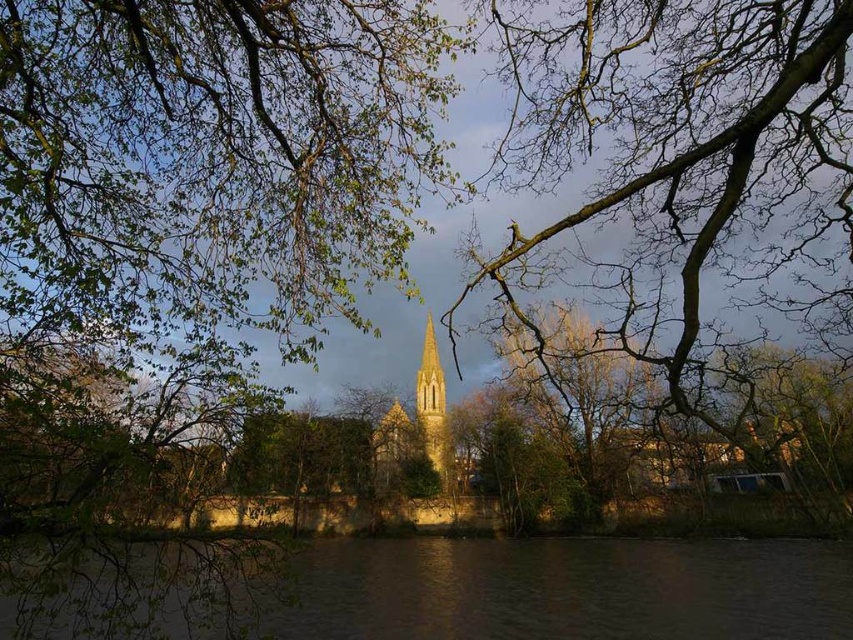
Question: Which point is closer to the camera?

Choices:
 (A) (428, 392)
 (B) (387, 419)

Answer: (B)

Question: Which point is closer to the camera taking this photo?

Choices:
 (A) (433, 464)
 (B) (438, 416)
 (C) (801, 570)
 (D) (677, 109)

Answer: (D)

Question: Can you confirm if bare branches at center is wider than golden stone church steeple at center?

Choices:
 (A) no
 (B) yes

Answer: (B)

Question: Considering the relative positions of golden stone church steeple at center and golden stone church tower at center in the image provided, where is golden stone church steeple at center located with respect to golden stone church tower at center?

Choices:
 (A) left
 (B) right

Answer: (A)

Question: Estimate the real-world distances between objects in this image. Which object is closer to the brown water at lower center?

Choices:
 (A) bare branches at center
 (B) golden stone church tower at center
 (C) golden stone church steeple at center

Answer: (A)

Question: Is bare branches at center to the left of golden stone church steeple at center from the viewer's perspective?

Choices:
 (A) no
 (B) yes

Answer: (A)